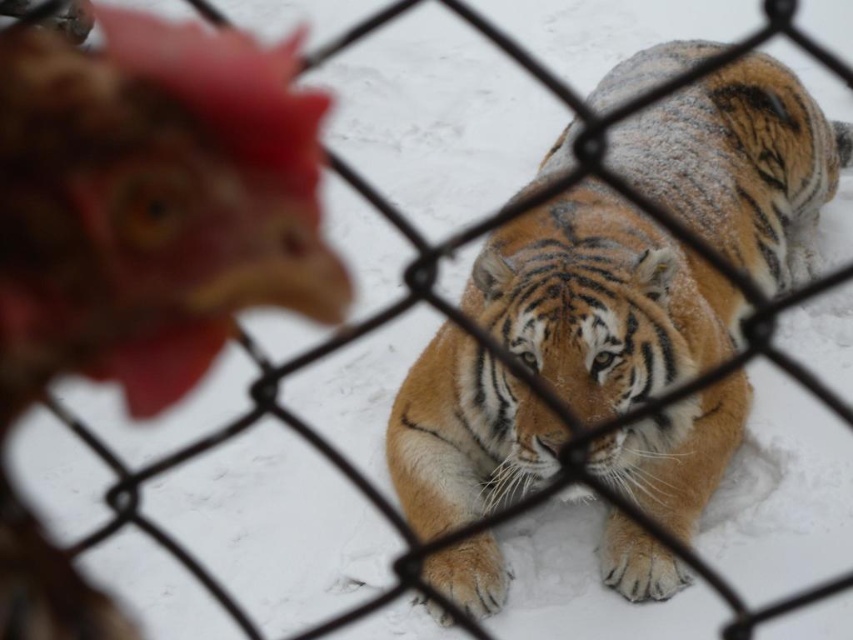
You are a zookeeper who needs to ensure the safety of both animals. Given that the chain link fence is 1.5 meters tall, can you confirm if the orange fur tiger at center and the brown feathered chicken at left are safely separated by the fence based on their sizes?

The orange fur tiger at center is bigger than the brown feathered chicken at left, but the fence height of 1.5 meters is sufficient to prevent either from jumping over, ensuring their separation.

You are standing in a snowy area and see the orange fur tiger at center and the brown feathered chicken at left separated by a fence. Which animal is closer to you?

The orange fur tiger at center is closer to the viewer than the brown feathered chicken at left.